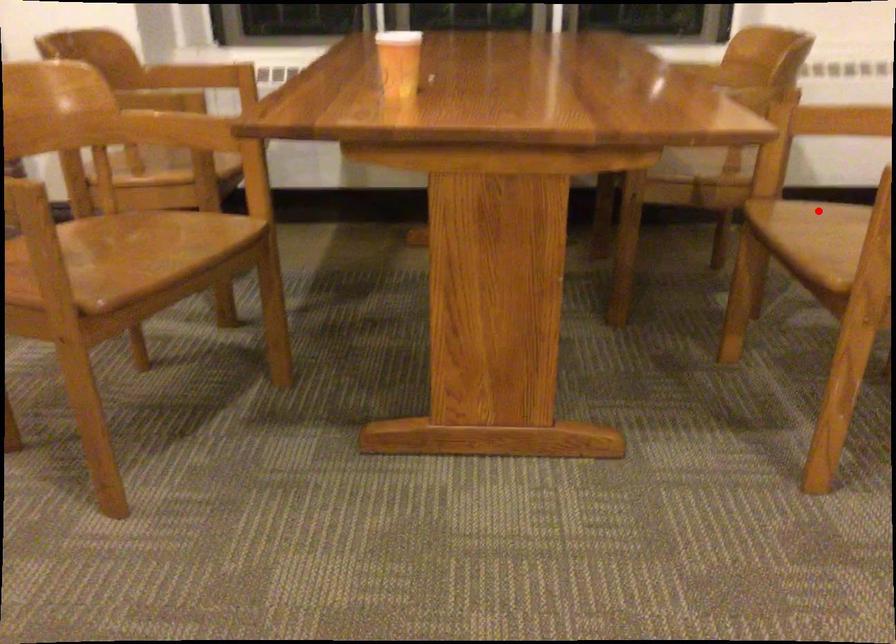
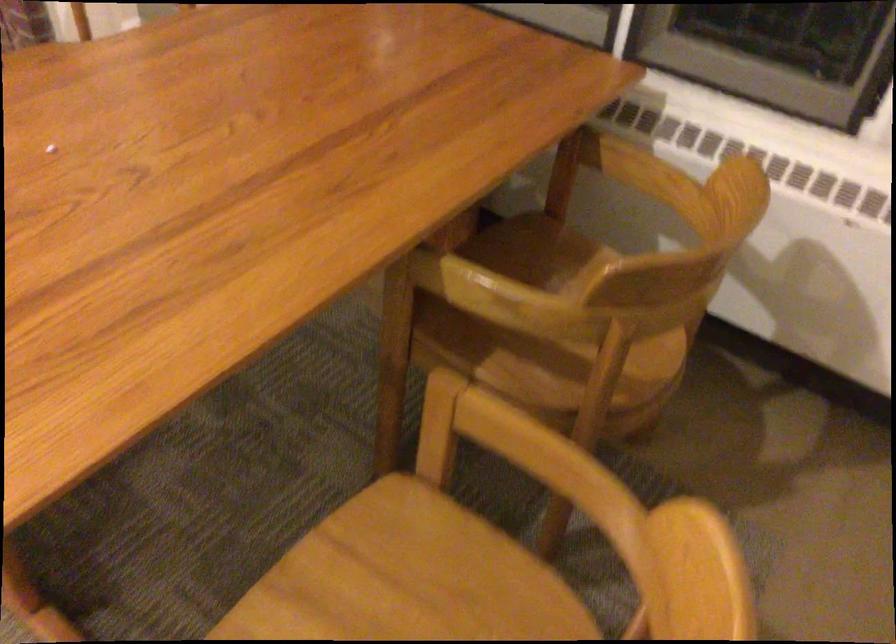
Question: I am providing you with two images of the same scene from different viewpoints. Given a red point in image1, look at the same physical point in image2. Is it:

Choices:
 (A) Closer to the viewpoint
 (B) Farther from the viewpoint

Answer: (A)